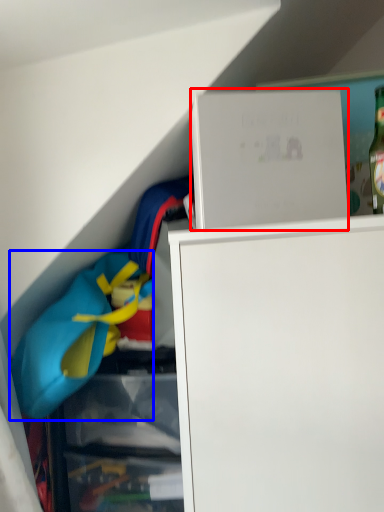
Question: Which of the following is the farthest to the observer, cabinet (highlighted by a red box) or clothing (highlighted by a blue box)?

Choices:
 (A) cabinet
 (B) clothing

Answer: (B)